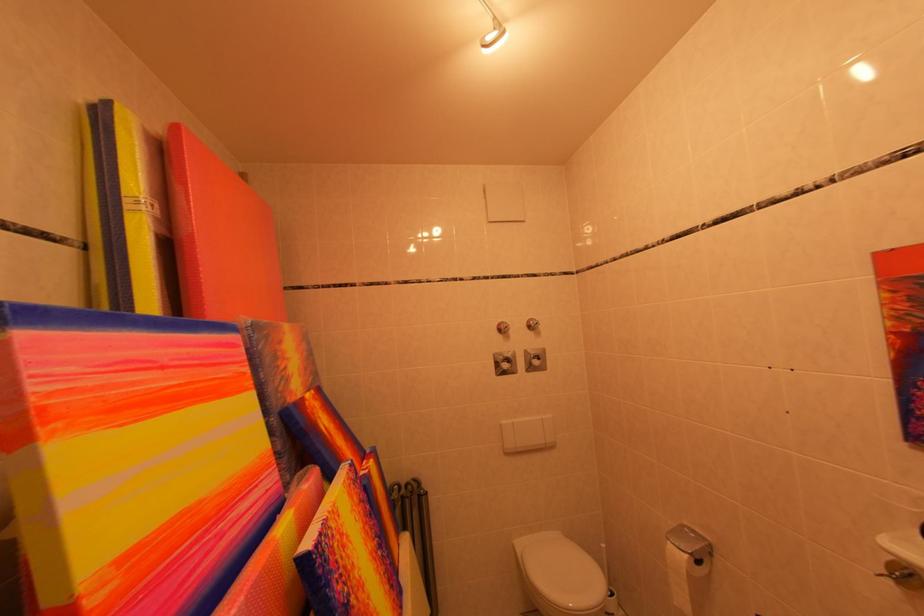
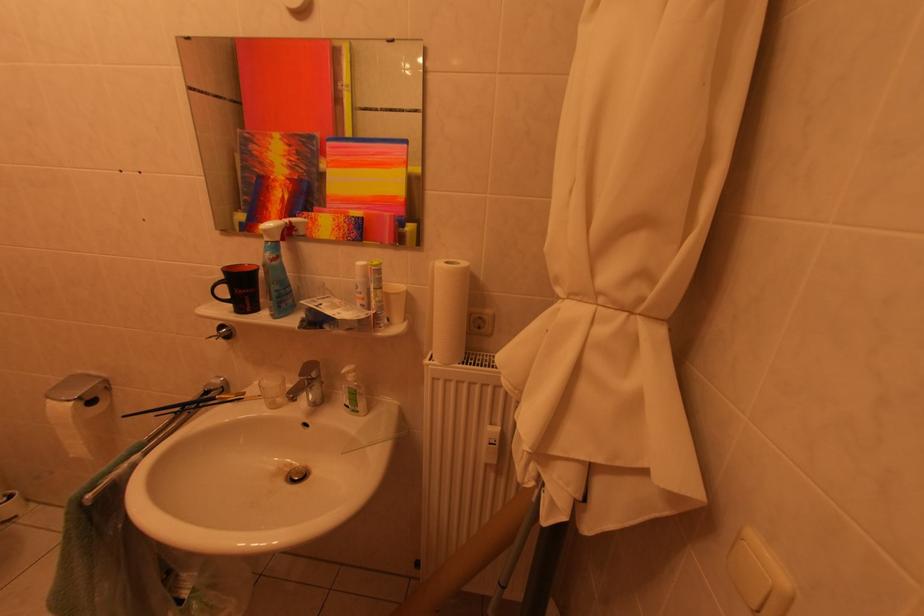
Based on the photo, how did the camera likely rotate?

The camera's rotation is toward right-down.